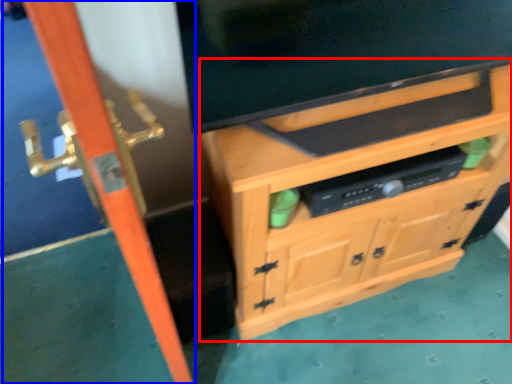
Question: Among these objects, which one is farthest to the camera, cabinetry (highlighted by a red box) or screen door (highlighted by a blue box)?

Choices:
 (A) cabinetry
 (B) screen door

Answer: (A)